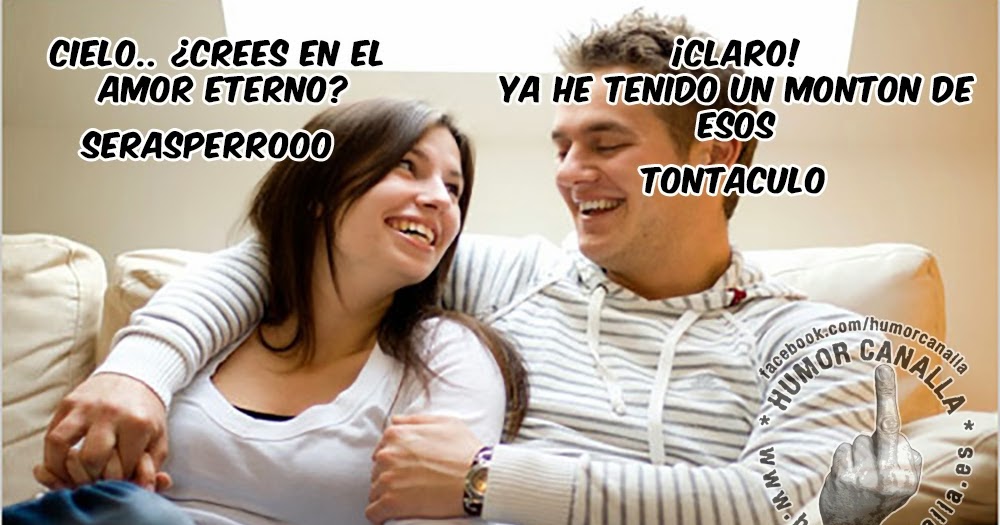
Image resolution: width=1000 pixels, height=525 pixels. Identify the location of wall. (60, 136).